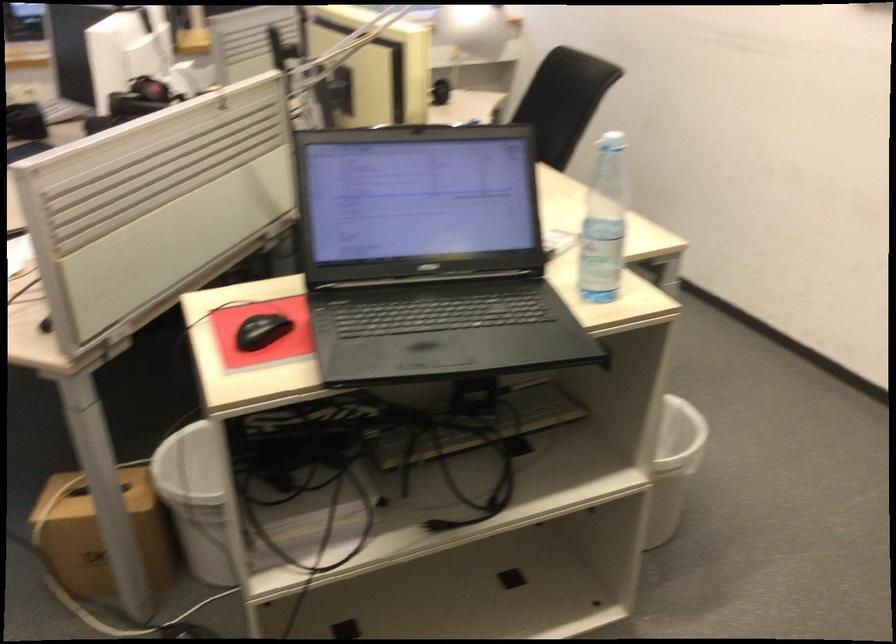
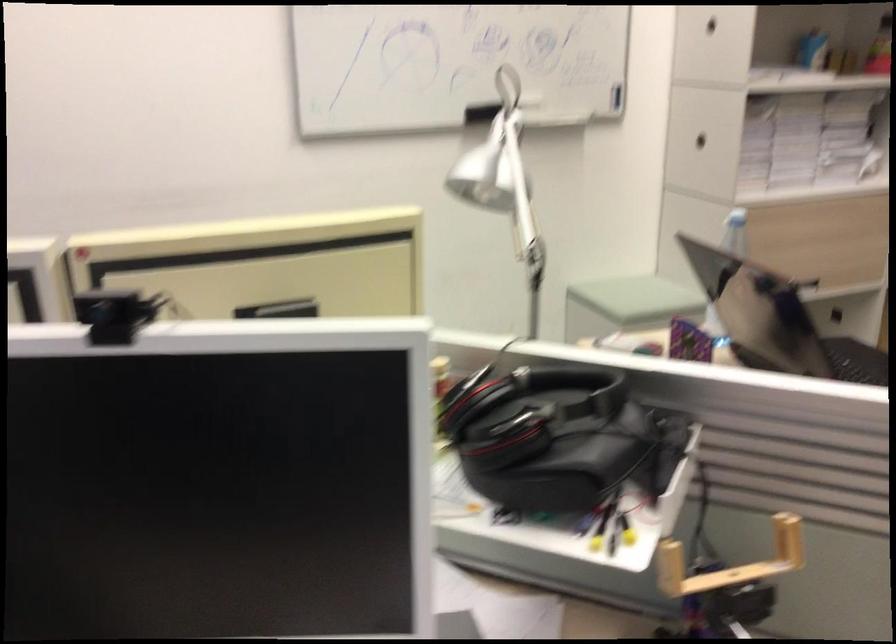
Question: I am providing you with two images of the same scene from different viewpoints. After the viewpoint changes to image2, which objects are now occluded?

Choices:
 (A) black webcam
 (B) water bottle
 (C) hardcover book
 (D) white trash can

Answer: (D)